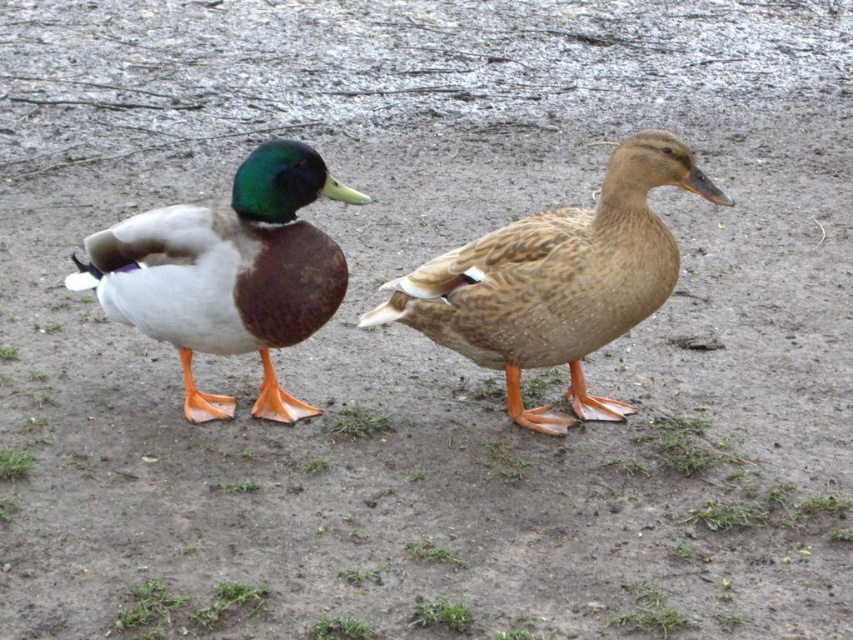
You are a wildlife photographer trying to capture a photo of both the brown feathered duck at center and the matte brown duck at left. You need to know which duck is wider to ensure proper framing. Can you tell me which duck has a greater width?

The brown feathered duck at center has a greater width than the matte brown duck at left.

You are a birdwatcher observing two ducks in a muddy field. You notice a brown feathered duck at center and a matte brown duck at left. Which duck is taller?

The brown feathered duck at center is taller than the matte brown duck at left.

You are observing two ducks on a muddy ground. There is a brown feathered duck at center and another duck. Which duck is more to the right?

The brown feathered duck at center is located at point (556,280), so the other duck is more to the left and the brown one is more to the right.